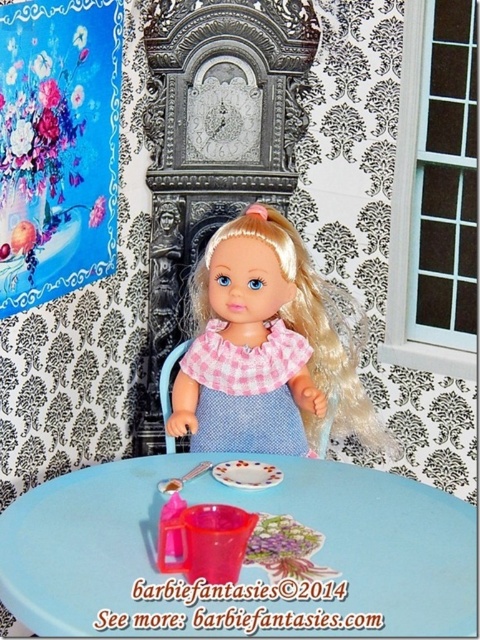
You are a guest at a dollhouse party and want to place a gift on the table. Can you tell me which object is closer to you, the blue plastic table at center or the pink checkered fabric dress at center?

The blue plastic table at center is closer to you since it is in front of the pink checkered fabric dress at center.

The doll is sitting at a table with several items. Which object is located at the coordinates point (265, 349)?

The point (265, 349) corresponds to the pink checkered fabric doll at center.

Looking at this image, you are a tiny robot exactly at the point with coordinates [245,550]. Where are you standing?

The point at coordinates [245,550] is the location of the blue plastic table at center.